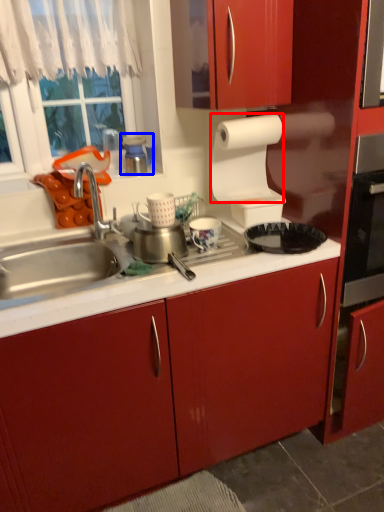
Question: Which of the following is the farthest to the observer, paper towel (highlighted by a red box) or appliance (highlighted by a blue box)?

Choices:
 (A) paper towel
 (B) appliance

Answer: (B)